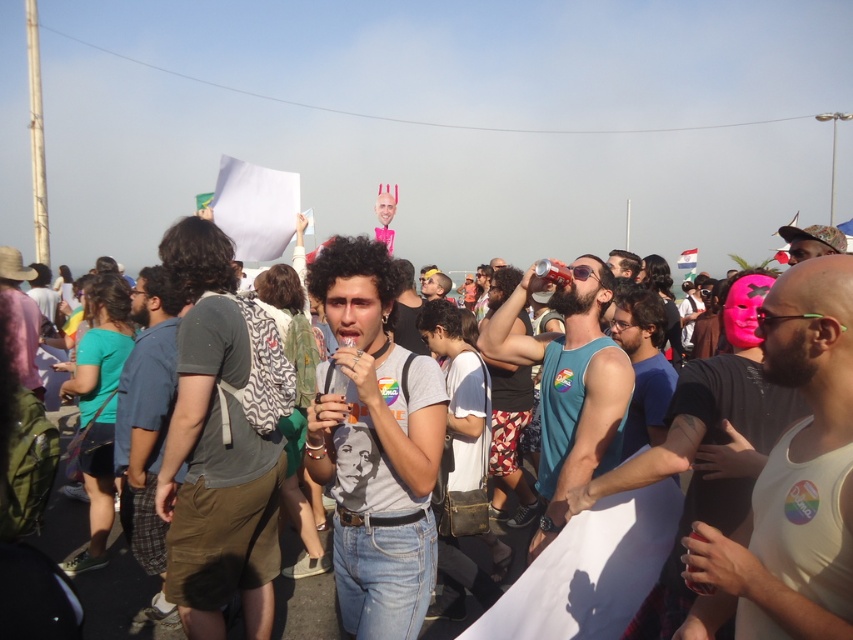
Question: Estimate the real-world distances between objects in this image. Which object is closer to the white tank top at center?

Choices:
 (A) dark gray cotton t-shirt at center
 (B) blue fabric shirt at center

Answer: (B)

Question: Is dark gray cotton t-shirt at center to the left of matte blue tank top at center from the viewer's perspective?

Choices:
 (A) yes
 (B) no

Answer: (A)

Question: Considering the relative positions of matte gray t-shirt at center and blue denim jeans at center in the image provided, where is matte gray t-shirt at center located with respect to blue denim jeans at center?

Choices:
 (A) above
 (B) below

Answer: (A)

Question: Which point is closer to the camera?

Choices:
 (A) pink matte mask at center
 (B) matte blue tank top at center

Answer: (A)

Question: Which object is positioned farthest from the matte gray t-shirt at center?

Choices:
 (A) blue fabric shirt at center
 (B) white tank top at center

Answer: (A)

Question: Is white tank top at center behind pink matte mask at center?

Choices:
 (A) no
 (B) yes

Answer: (A)